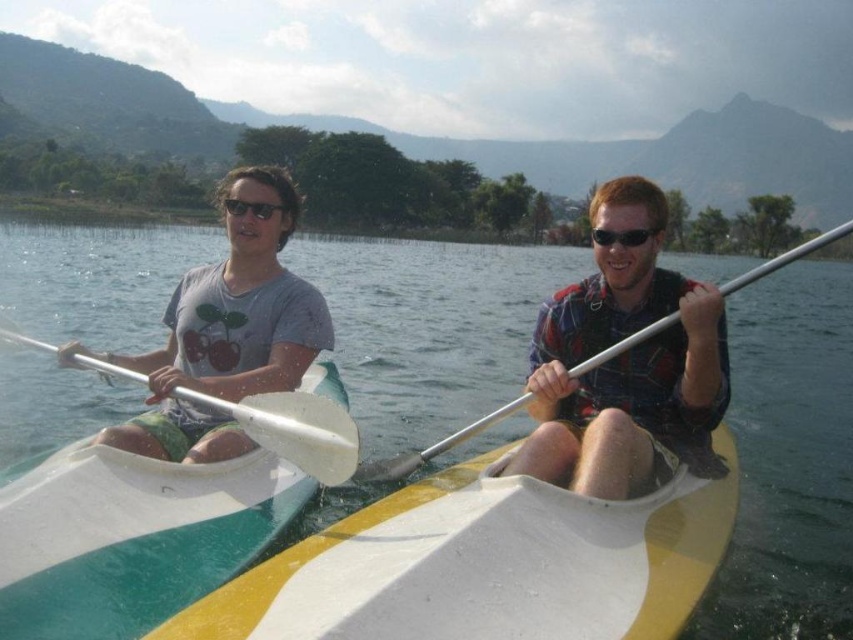
Does matte gray t-shirt at left appear under black plastic sunglasses at upper center?

Yes.

Is matte gray t-shirt at left to the right of black plastic sunglasses at upper center from the viewer's perspective?

Correct, you'll find matte gray t-shirt at left to the right of black plastic sunglasses at upper center.

Find the location of a particular element. Image resolution: width=853 pixels, height=640 pixels. matte gray t-shirt at left is located at coordinates (228, 332).

Which is more to the right, matte gray t-shirt at left or white plastic paddle at center?

From the viewer's perspective, white plastic paddle at center appears more on the right side.

Does point (202, 275) lie in front of point (399, 461)?

No.

Is point (323, 337) positioned behind point (602, 356)?

Yes, point (323, 337) is behind point (602, 356).

The image size is (853, 640). In order to click on matte gray t-shirt at left in this screenshot , I will do `click(228, 332)`.

Which of these two, white glossy kayak at left or matte gray t-shirt at left, stands taller?

With more height is white glossy kayak at left.

Does white glossy kayak at left appear on the right side of matte gray t-shirt at left?

No, white glossy kayak at left is not to the right of matte gray t-shirt at left.

Between point (241, 518) and point (200, 435), which one is positioned behind?

The point (200, 435) is behind.

Locate an element on the screen. The width and height of the screenshot is (853, 640). white glossy kayak at left is located at coordinates (160, 516).